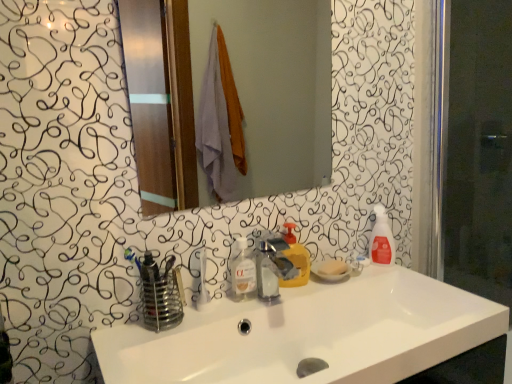
Question: Can we say clear liquid soap at center lies outside translucent plastic spray bottle at right, placed as the 2th cleaning product when sorted from left to right?

Choices:
 (A) yes
 (B) no

Answer: (A)

Question: Considering the relative sizes of clear liquid soap at center and translucent plastic spray bottle at right, the first cleaning product in the back-to-front sequence, in the image provided, is clear liquid soap at center bigger than translucent plastic spray bottle at right, the first cleaning product in the back-to-front sequence,?

Choices:
 (A) no
 (B) yes

Answer: (A)

Question: From a real-world perspective, is clear liquid soap at center located beneath translucent plastic spray bottle at right, acting as the 1th cleaning product starting from the right?

Choices:
 (A) yes
 (B) no

Answer: (A)

Question: Considering the relative sizes of clear liquid soap at center and translucent plastic spray bottle at right, arranged as the second cleaning product when viewed from the front, in the image provided, is clear liquid soap at center thinner than translucent plastic spray bottle at right, arranged as the second cleaning product when viewed from the front,?

Choices:
 (A) no
 (B) yes

Answer: (B)

Question: Could you tell me if clear liquid soap at center is facing translucent plastic spray bottle at right, the first cleaning product in the back-to-front sequence?

Choices:
 (A) no
 (B) yes

Answer: (A)

Question: From a real-world perspective, is white glossy sink at center positioned above or below translucent plastic spray bottle at right, the first cleaning product in the back-to-front sequence?

Choices:
 (A) above
 (B) below

Answer: (B)

Question: Is point (204, 357) positioned closer to the camera than point (371, 248)?

Choices:
 (A) closer
 (B) farther

Answer: (A)

Question: Considering the positions of white glossy sink at center and translucent plastic spray bottle at right, placed as the 2th cleaning product when sorted from left to right, in the image, is white glossy sink at center wider or thinner than translucent plastic spray bottle at right, placed as the 2th cleaning product when sorted from left to right,?

Choices:
 (A) thin
 (B) wide

Answer: (B)

Question: Considering their positions, is white glossy sink at center located in front of or behind translucent plastic spray bottle at right, placed as the 2th cleaning product when sorted from left to right?

Choices:
 (A) behind
 (B) front

Answer: (B)

Question: From a real-world perspective, is metallic silver faucet at center physically located above or below white glossy sink at center?

Choices:
 (A) below
 (B) above

Answer: (B)

Question: From the image's perspective, is metallic silver faucet at center positioned above or below white glossy sink at center?

Choices:
 (A) above
 (B) below

Answer: (A)

Question: Is metallic silver faucet at center taller or shorter than white glossy sink at center?

Choices:
 (A) tall
 (B) short

Answer: (A)

Question: Looking at their shapes, would you say metallic silver faucet at center is wider or thinner than white glossy sink at center?

Choices:
 (A) wide
 (B) thin

Answer: (B)

Question: Considering the positions of translucent plastic spray bottle at right, placed as the 2th cleaning product when sorted from left to right, and white glossy mirror at upper center in the image, is translucent plastic spray bottle at right, placed as the 2th cleaning product when sorted from left to right, wider or thinner than white glossy mirror at upper center?

Choices:
 (A) thin
 (B) wide

Answer: (B)

Question: From a real-world perspective, relative to white glossy mirror at upper center, is translucent plastic spray bottle at right, arranged as the second cleaning product when viewed from the front, vertically above or below?

Choices:
 (A) below
 (B) above

Answer: (A)